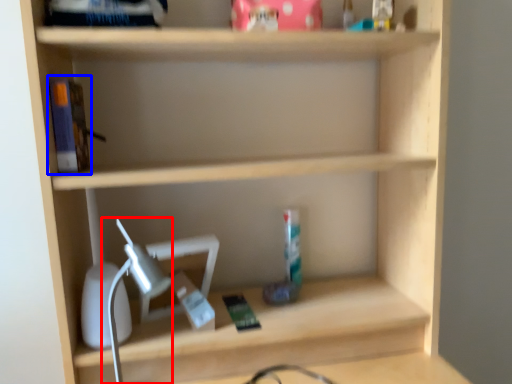
Question: Which point is further to the camera, table lamp (highlighted by a red box) or book (highlighted by a blue box)?

Choices:
 (A) table lamp
 (B) book

Answer: (B)